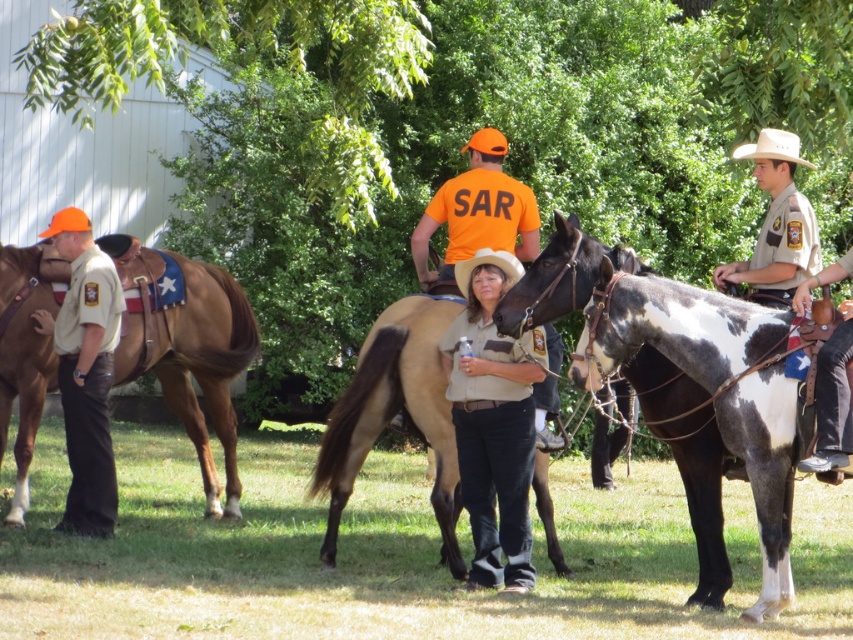
Question: Is tan uniform at left below white felt cowboy hat at upper right?

Choices:
 (A) no
 (B) yes

Answer: (B)

Question: Can you confirm if brown leather saddle at left is bigger than white felt cowboy hat at upper right?

Choices:
 (A) no
 (B) yes

Answer: (B)

Question: Where is brown uniform at center located in relation to white felt cowboy hat at upper right in the image?

Choices:
 (A) left
 (B) right

Answer: (A)

Question: Which point is farther from the camera taking this photo?

Choices:
 (A) (688, 449)
 (B) (567, 532)
 (C) (822, 268)
 (D) (442, 429)

Answer: (B)

Question: Estimate the real-world distances between objects in this image. Which object is closer to the brown leather saddle at left?

Choices:
 (A) brown uniform at center
 (B) tan uniform at left
 (C) green grass at lower center

Answer: (B)

Question: Which point is farther from the camera taking this photo?

Choices:
 (A) (788, 131)
 (B) (77, 496)
 (C) (225, 609)

Answer: (A)